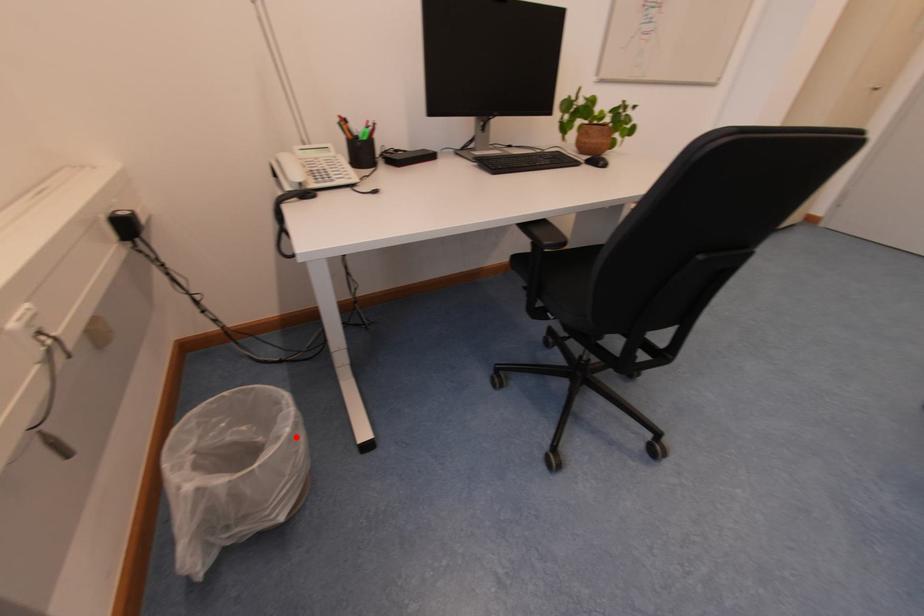
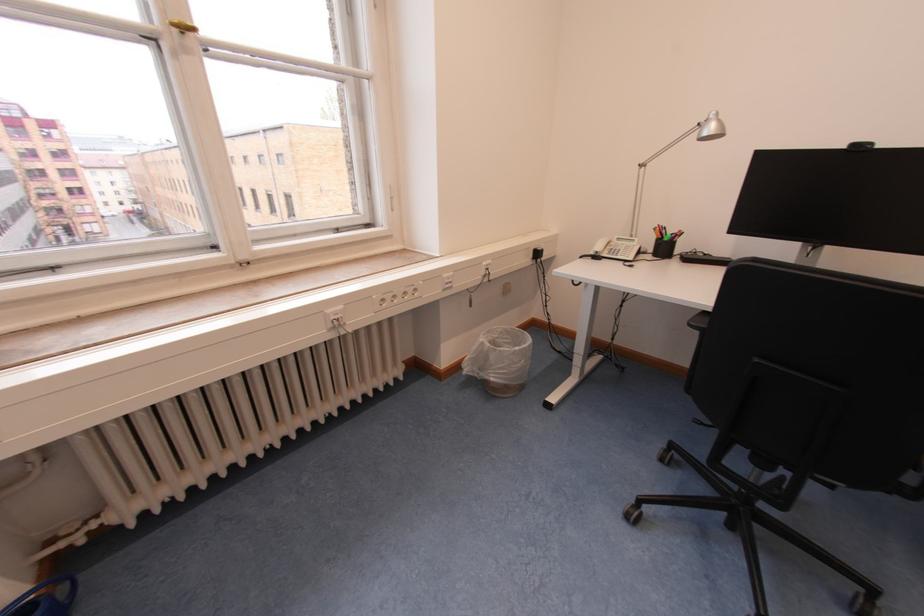
Locate, in the second image, the point that corresponds to the highlighted location in the first image.

(524, 353)